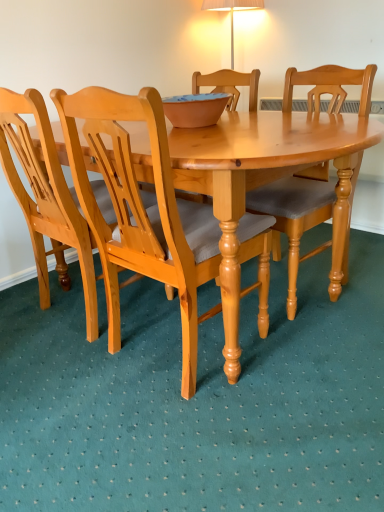
What do you see at coordinates (294, 218) in the screenshot? This screenshot has height=512, width=384. I see `light brown wood chair at center, marked as the third chair in a left-to-right arrangement` at bounding box center [294, 218].

What is the approximate width of light brown wood chair at left, the first chair in the left-to-right sequence?

light brown wood chair at left, the first chair in the left-to-right sequence, is 21.44 inches in width.

Where is `light brown wood chair at center, the second chair in the left-to-right sequence`? Image resolution: width=384 pixels, height=512 pixels. light brown wood chair at center, the second chair in the left-to-right sequence is located at coordinates (141, 211).

You are a GUI agent. You are given a task and a screenshot of the screen. Output one action in this format:
    pyautogui.click(x=<x>, y=<y>)
    Task: Click on the light brown wood chair at center, marked as the third chair in a left-to-right arrangement
    This screenshot has width=384, height=512.
    Given the screenshot: What is the action you would take?
    pyautogui.click(x=294, y=218)

Based on the photo, considering the relative sizes of light brown wood chair at center, the second chair in the left-to-right sequence, and light brown wood chair at left, placed as the 3th chair when sorted from right to left, in the image provided, is light brown wood chair at center, the second chair in the left-to-right sequence, smaller than light brown wood chair at left, placed as the 3th chair when sorted from right to left,?

No, light brown wood chair at center, the second chair in the left-to-right sequence, is not smaller than light brown wood chair at left, placed as the 3th chair when sorted from right to left.

Is light brown wood chair at center, which is the 2th chair from right to left, inside or outside of light brown wood chair at left, placed as the 3th chair when sorted from right to left?

light brown wood chair at center, which is the 2th chair from right to left, is located beyond the bounds of light brown wood chair at left, placed as the 3th chair when sorted from right to left.

This screenshot has width=384, height=512. What are the coordinates of `chair that is the 1st one when counting upward from the light brown wood chair at center, the second chair in the left-to-right sequence (from the image's perspective)` in the screenshot? It's located at (47, 199).

Are matte clay bowl at center and light brown wood chair at center, which is the 2th chair from right to left, making contact?

No, matte clay bowl at center is not with light brown wood chair at center, which is the 2th chair from right to left.

Is matte clay bowl at center thinner than light brown wood chair at center, the second chair in the left-to-right sequence?

Yes.

Which is in front, matte clay bowl at center or light brown wood chair at center, the second chair in the left-to-right sequence?

light brown wood chair at center, the second chair in the left-to-right sequence.

From a real-world perspective, is light brown wood chair at left, the first chair in the left-to-right sequence, located beneath light brown wood chair at center, which is the 2th chair from right to left?

No.

Is light brown wood chair at left, placed as the 3th chair when sorted from right to left, wider than light brown wood chair at center, which is the 2th chair from right to left?

No, light brown wood chair at left, placed as the 3th chair when sorted from right to left, is not wider than light brown wood chair at center, which is the 2th chair from right to left.

You are a GUI agent. You are given a task and a screenshot of the screen. Output one action in this format:
    pyautogui.click(x=<x>, y=<y>)
    Task: Click on the 1st chair behind the light brown wood chair at center, the second chair in the left-to-right sequence
    Image resolution: width=384 pixels, height=512 pixels.
    Given the screenshot: What is the action you would take?
    pyautogui.click(x=47, y=199)

Considering the relative sizes of light brown wood chair at left, the first chair in the left-to-right sequence, and light brown wood chair at center, which is the 2th chair from right to left, in the image provided, is light brown wood chair at left, the first chair in the left-to-right sequence, taller than light brown wood chair at center, which is the 2th chair from right to left,?

In fact, light brown wood chair at left, the first chair in the left-to-right sequence, may be shorter than light brown wood chair at center, which is the 2th chair from right to left.

From the picture: From the image's perspective, is light brown wood chair at center, which is counted as the first chair, starting from the right, under matte clay bowl at center?

Yes, from the image's perspective, light brown wood chair at center, which is counted as the first chair, starting from the right, is below matte clay bowl at center.

Looking at the image, does light brown wood chair at center, which is counted as the first chair, starting from the right, seem bigger or smaller compared to matte clay bowl at center?

Considering their sizes, light brown wood chair at center, which is counted as the first chair, starting from the right, takes up more space than matte clay bowl at center.

Which of these two, light brown wood chair at center, which is counted as the first chair, starting from the right, or matte clay bowl at center, is wider?

Wider between the two is light brown wood chair at center, which is counted as the first chair, starting from the right.

Is point (348, 243) closer or farther from the camera than point (180, 106)?

Point (348, 243).

Is light brown wood chair at center, marked as the third chair in a left-to-right arrangement, far away from light brown wood chair at center, which is the 2th chair from right to left?

No, there isn't a large distance between light brown wood chair at center, marked as the third chair in a left-to-right arrangement, and light brown wood chair at center, which is the 2th chair from right to left.

Based on their sizes in the image, would you say light brown wood chair at center, marked as the third chair in a left-to-right arrangement, is bigger or smaller than light brown wood chair at center, the second chair in the left-to-right sequence?

Clearly, light brown wood chair at center, marked as the third chair in a left-to-right arrangement, is smaller in size than light brown wood chair at center, the second chair in the left-to-right sequence.

Find the location of a particular element. This screenshot has height=512, width=384. the 2nd chair below when counting from the light brown wood chair at center, marked as the third chair in a left-to-right arrangement (from the image's perspective) is located at coordinates (141, 211).

Is light brown wood chair at center, marked as the third chair in a left-to-right arrangement, shorter than light brown wood chair at center, the second chair in the left-to-right sequence?

Correct, light brown wood chair at center, marked as the third chair in a left-to-right arrangement, is not as tall as light brown wood chair at center, the second chair in the left-to-right sequence.

Is light brown wood chair at center, which is counted as the first chair, starting from the right, wider or thinner than light brown wood chair at left, placed as the 3th chair when sorted from right to left?

light brown wood chair at center, which is counted as the first chair, starting from the right, is wider than light brown wood chair at left, placed as the 3th chair when sorted from right to left.

Considering the relative sizes of light brown wood chair at center, marked as the third chair in a left-to-right arrangement, and light brown wood chair at left, placed as the 3th chair when sorted from right to left, in the image provided, is light brown wood chair at center, marked as the third chair in a left-to-right arrangement, taller than light brown wood chair at left, placed as the 3th chair when sorted from right to left,?

No, light brown wood chair at center, marked as the third chair in a left-to-right arrangement, is not taller than light brown wood chair at left, placed as the 3th chair when sorted from right to left.

From a real-world perspective, is light brown wood chair at center, marked as the third chair in a left-to-right arrangement, positioned above or below light brown wood chair at left, the first chair in the left-to-right sequence?

light brown wood chair at center, marked as the third chair in a left-to-right arrangement, is situated lower than light brown wood chair at left, the first chair in the left-to-right sequence, in the real world.

Between point (363, 91) and point (54, 236), which one is positioned behind?

The point (54, 236) is farther.

In terms of size, does light brown wood chair at center, the second chair in the left-to-right sequence, appear bigger or smaller than matte clay bowl at center?

Considering their sizes, light brown wood chair at center, the second chair in the left-to-right sequence, takes up more space than matte clay bowl at center.

There is a matte clay bowl at center. In order to click on the 3rd chair below it (from the image's perspective) in this screenshot , I will do `click(141, 211)`.

Between light brown wood chair at center, the second chair in the left-to-right sequence, and matte clay bowl at center, which one has larger width?

light brown wood chair at center, the second chair in the left-to-right sequence, is wider.

Identify the location of the 2nd chair positioned above the light brown wood chair at center, the second chair in the left-to-right sequence (from a real-world perspective). (47, 199).

Starting from the matte clay bowl at center, which chair is the 1st one to the left? Please provide its 2D coordinates.

[(141, 211)]

Based on their spatial positions, is matte clay bowl at center or light brown wood chair at center, the second chair in the left-to-right sequence, further from light brown wood chair at left, the first chair in the left-to-right sequence?

Based on the image, matte clay bowl at center appears to be further to light brown wood chair at left, the first chair in the left-to-right sequence.

Estimate the real-world distances between objects in this image. Which object is closer to light brown wood chair at center, marked as the third chair in a left-to-right arrangement, matte clay bowl at center or light brown wood chair at center, which is the 2th chair from right to left?

light brown wood chair at center, which is the 2th chair from right to left.

When comparing their distances from light brown wood chair at center, marked as the third chair in a left-to-right arrangement, does light brown wood chair at left, the first chair in the left-to-right sequence, or light brown wood chair at center, which is the 2th chair from right to left, seem further?

light brown wood chair at left, the first chair in the left-to-right sequence.

Considering their positions, is light brown wood chair at center, which is the 2th chair from right to left, positioned further to matte clay bowl at center than light brown wood chair at center, which is counted as the first chair, starting from the right?

light brown wood chair at center, which is counted as the first chair, starting from the right, is further to matte clay bowl at center.

Which object lies further to the anchor point light brown wood chair at center, which is the 2th chair from right to left, matte clay bowl at center or light brown wood chair at center, marked as the third chair in a left-to-right arrangement?

Among the two, matte clay bowl at center is located further to light brown wood chair at center, which is the 2th chair from right to left.

When comparing their distances from matte clay bowl at center, does light brown wood chair at center, which is counted as the first chair, starting from the right, or light brown wood chair at left, the first chair in the left-to-right sequence, seem closer?

Among the two, light brown wood chair at center, which is counted as the first chair, starting from the right, is located nearer to matte clay bowl at center.

When comparing their distances from light brown wood chair at center, marked as the third chair in a left-to-right arrangement, does light brown wood chair at left, placed as the 3th chair when sorted from right to left, or matte clay bowl at center seem closer?

matte clay bowl at center.

Estimate the real-world distances between objects in this image. Which object is closer to light brown wood chair at center, the second chair in the left-to-right sequence, light brown wood chair at center, marked as the third chair in a left-to-right arrangement, or matte clay bowl at center?

light brown wood chair at center, marked as the third chair in a left-to-right arrangement, lies closer to light brown wood chair at center, the second chair in the left-to-right sequence, than the other object.

Locate an element on the screen. bowl between light brown wood chair at left, the first chair in the left-to-right sequence, and light brown wood chair at center, marked as the third chair in a left-to-right arrangement, in the horizontal direction is located at coordinates (195, 109).

Where is `chair situated between light brown wood chair at left, placed as the 3th chair when sorted from right to left, and light brown wood chair at center, which is counted as the first chair, starting from the right, from left to right`? This screenshot has width=384, height=512. chair situated between light brown wood chair at left, placed as the 3th chair when sorted from right to left, and light brown wood chair at center, which is counted as the first chair, starting from the right, from left to right is located at coordinates (141, 211).